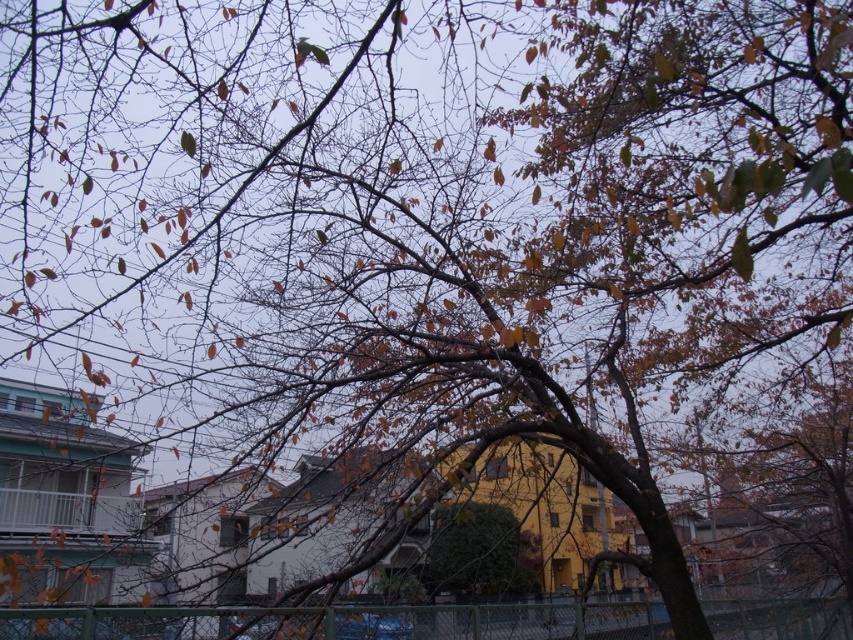
Question: Is the position of green chain-link fence at lower center more distant than that of green leafy bush at center?

Choices:
 (A) no
 (B) yes

Answer: (A)

Question: Among these points, which one is farthest from the camera?

Choices:
 (A) (450, 545)
 (B) (735, 611)

Answer: (A)

Question: Is green chain-link fence at lower center positioned before green leafy bush at center?

Choices:
 (A) no
 (B) yes

Answer: (B)

Question: Does green chain-link fence at lower center have a smaller size compared to green leafy bush at center?

Choices:
 (A) no
 (B) yes

Answer: (A)

Question: Which object appears closest to the camera in this image?

Choices:
 (A) green leafy bush at center
 (B) green chain-link fence at lower center

Answer: (B)

Question: Which object appears farthest from the camera in this image?

Choices:
 (A) green leafy bush at center
 (B) green chain-link fence at lower center

Answer: (A)